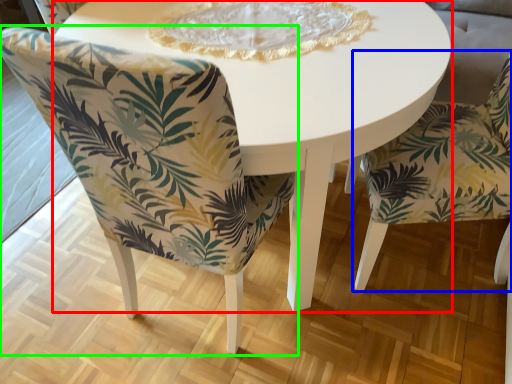
Question: Considering the real-world distances, which object is closest to coffee table (highlighted by a red box)? chair (highlighted by a blue box) or chair (highlighted by a green box).

Choices:
 (A) chair
 (B) chair

Answer: (B)